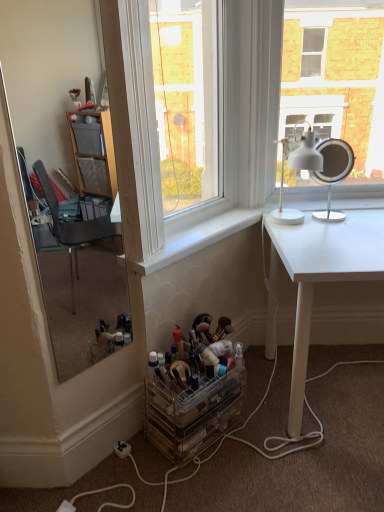
Question: From the image's perspective, is clear glass window at center on clear acrylic makeup organizer at lower center?

Choices:
 (A) no
 (B) yes

Answer: (B)

Question: Does clear glass window at center have a lesser width compared to clear acrylic makeup organizer at lower center?

Choices:
 (A) no
 (B) yes

Answer: (B)

Question: From a real-world perspective, is clear glass window at center below clear acrylic makeup organizer at lower center?

Choices:
 (A) no
 (B) yes

Answer: (A)

Question: Is clear glass window at center bigger than clear acrylic makeup organizer at lower center?

Choices:
 (A) no
 (B) yes

Answer: (B)

Question: Is clear glass window at center oriented towards clear acrylic makeup organizer at lower center?

Choices:
 (A) no
 (B) yes

Answer: (A)

Question: Visually, is white matte table lamp at upper right, the second table lamp positioned from the right, positioned to the left or to the right of white smooth window sill at center?

Choices:
 (A) left
 (B) right

Answer: (B)

Question: Would you say white matte table lamp at upper right, the 1th table lamp positioned from the left, is inside or outside white smooth window sill at center?

Choices:
 (A) outside
 (B) inside

Answer: (A)

Question: Considering the positions of white matte table lamp at upper right, the 1th table lamp positioned from the left, and white smooth window sill at center in the image, is white matte table lamp at upper right, the 1th table lamp positioned from the left, wider or thinner than white smooth window sill at center?

Choices:
 (A) wide
 (B) thin

Answer: (A)

Question: Is point (317, 160) positioned closer to the camera than point (205, 241)?

Choices:
 (A) farther
 (B) closer

Answer: (B)

Question: Is point (187, 380) closer or farther from the camera than point (119, 446)?

Choices:
 (A) closer
 (B) farther

Answer: (A)

Question: Is clear plastic makeup organizer at lower left situated inside white plastic power outlet at lower center or outside?

Choices:
 (A) outside
 (B) inside

Answer: (A)

Question: From the image's perspective, is clear plastic makeup organizer at lower left positioned above or below white plastic power outlet at lower center?

Choices:
 (A) above
 (B) below

Answer: (A)

Question: In the image, is clear plastic makeup organizer at lower left on the left side or the right side of white plastic power outlet at lower center?

Choices:
 (A) left
 (B) right

Answer: (B)

Question: In the image, is white smooth window sill at center positioned in front of or behind clear glass window at center?

Choices:
 (A) behind
 (B) front

Answer: (A)

Question: Considering the positions of white smooth window sill at center and clear glass window at center in the image, is white smooth window sill at center taller or shorter than clear glass window at center?

Choices:
 (A) short
 (B) tall

Answer: (A)